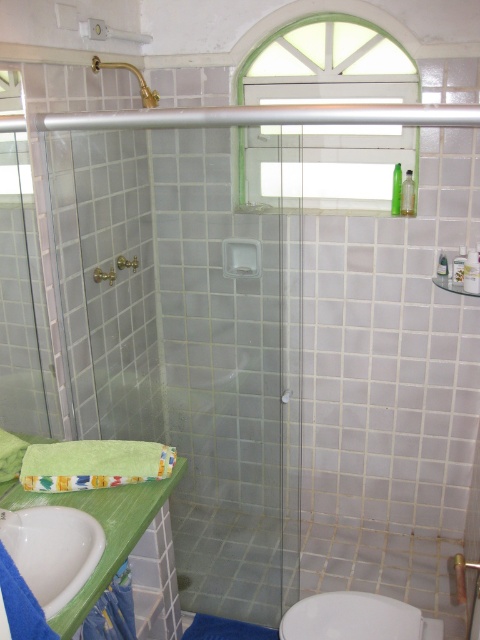
Question: Which point appears closest to the camera in this image?

Choices:
 (A) (364, 593)
 (B) (96, 634)

Answer: (B)

Question: Which object is closer to the camera taking this photo?

Choices:
 (A) white glossy sink at lower left
 (B) white glossy toilet bowl at lower right

Answer: (A)

Question: Which point is farther to the camera?

Choices:
 (A) (101, 61)
 (B) (129, 632)
 (C) (92, 534)
 (D) (316, 609)

Answer: (A)

Question: Can you confirm if white glossy sink at lower left is thinner than white glossy toilet bowl at lower right?

Choices:
 (A) no
 (B) yes

Answer: (B)

Question: Does white glossy toilet bowl at lower right have a larger size compared to blue fabric shower curtain at lower left?

Choices:
 (A) no
 (B) yes

Answer: (A)

Question: Observing the image, what is the correct spatial positioning of white glossy toilet bowl at lower right in reference to gold metallic faucet at upper left?

Choices:
 (A) below
 (B) above

Answer: (A)